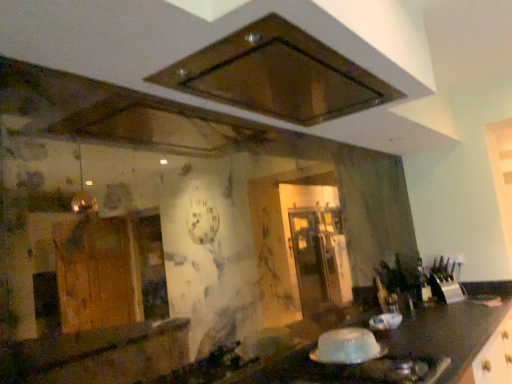
Question: From a real-world perspective, relative to brown matte exhaust hood at upper center, is white glossy gas stove at lower right vertically above or below?

Choices:
 (A) below
 (B) above

Answer: (A)

Question: Considering the positions of white glossy gas stove at lower right and brown matte exhaust hood at upper center in the image, is white glossy gas stove at lower right wider or thinner than brown matte exhaust hood at upper center?

Choices:
 (A) wide
 (B) thin

Answer: (A)

Question: Estimate the real-world distances between objects in this image. Which object is farther from the brown matte exhaust hood at upper center?

Choices:
 (A) translucent plastic container at lower center
 (B) metallic silver knife block at right
 (C) white glossy gas stove at lower right

Answer: (B)

Question: Estimate the real-world distances between objects in this image. Which object is farther from the metallic silver knife block at right?

Choices:
 (A) translucent plastic container at lower center
 (B) white glossy gas stove at lower right
 (C) brown matte exhaust hood at upper center

Answer: (C)